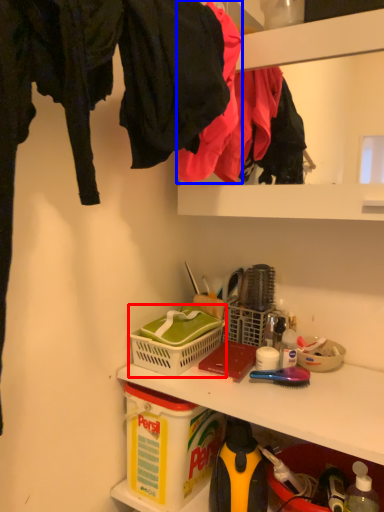
Question: Which point is closer to the camera, picnic basket (highlighted by a red box) or clothing (highlighted by a blue box)?

Choices:
 (A) picnic basket
 (B) clothing

Answer: (B)